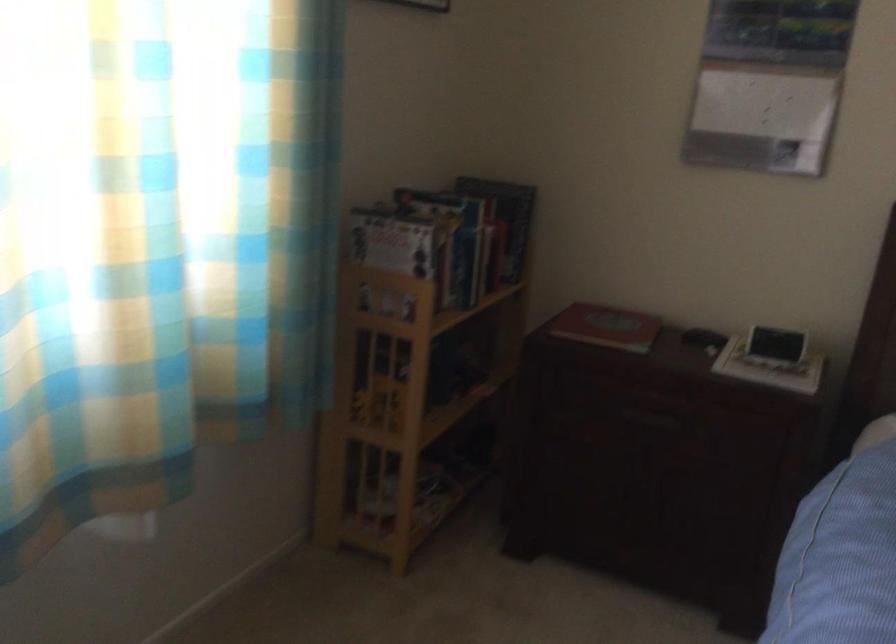
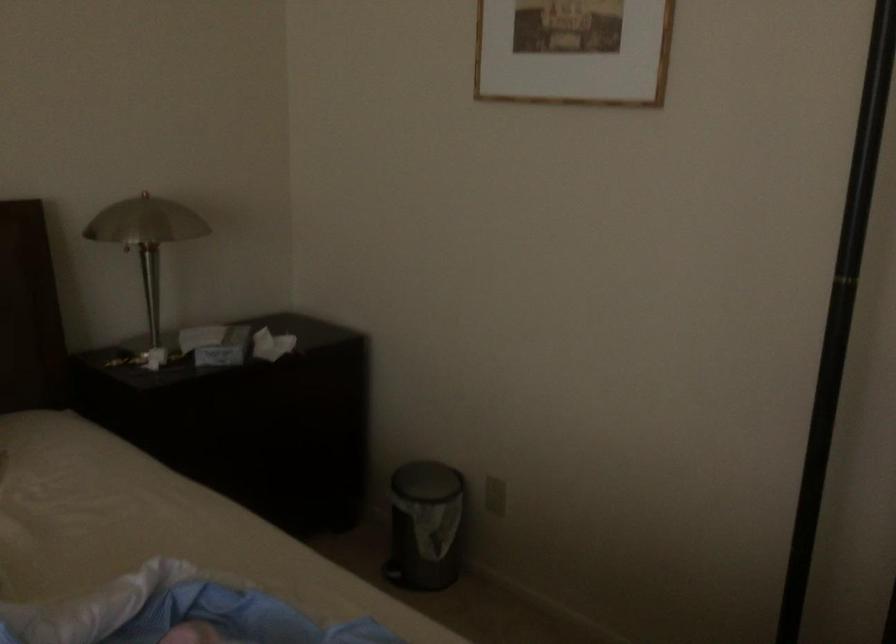
How did the camera likely rotate?

The rotation direction of the camera is right-down.